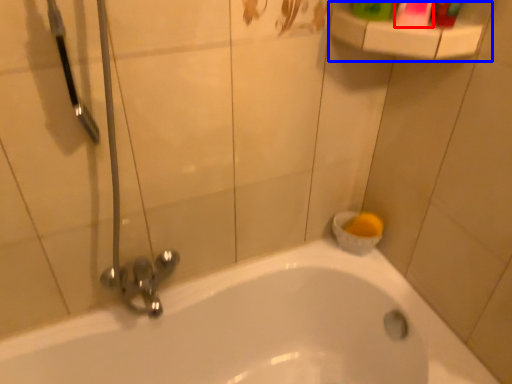
Question: Which of the following is the farthest to the observer, mouthwash (highlighted by a red box) or balustrade (highlighted by a blue box)?

Choices:
 (A) mouthwash
 (B) balustrade

Answer: (B)